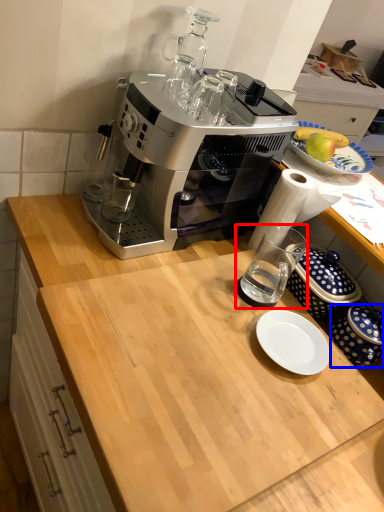
Question: Among these objects, which one is farthest to the camera, coffee cup (highlighted by a red box) or tableware (highlighted by a blue box)?

Choices:
 (A) coffee cup
 (B) tableware

Answer: (A)